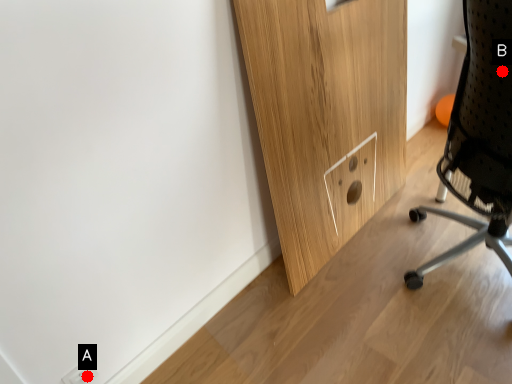
Question: Two points are circled on the image, labeled by A and B beside each circle. Which point is farther to the camera?

Choices:
 (A) A is further
 (B) B is further

Answer: (A)